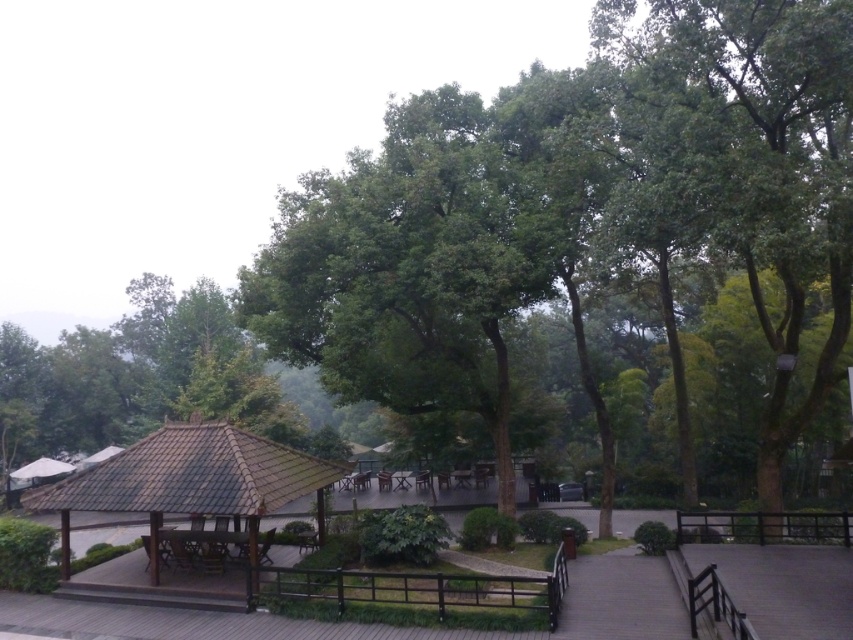
You are planning to install a new lighting system in the park. You have two options for placement based on the image. The first option is to place lights under the brown wooden gazebo at center, and the second is under the white fabric canopy at upper left. Considering their heights, which location would require taller light poles?

The brown wooden gazebo at center is taller than the white fabric canopy at upper left, so installing lights under the brown wooden gazebo at center would require taller light poles to ensure proper illumination.

Based on the photo, you are standing at the point with coordinates (189,481) in the park. What object is located exactly at your current position?

The brown wooden gazebo at center is located exactly at point (189,481).